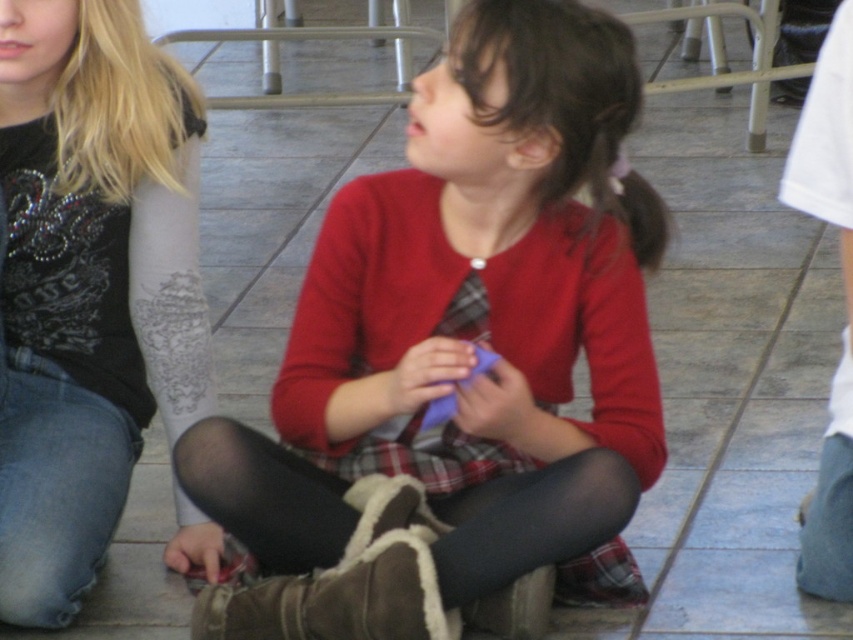
Identify the location of matte red sweater at center. (471, 326).

Is the position of matte red sweater at center less distant than that of matte black shirt at left?

Yes, it is.

At what (x,y) coordinates should I click in order to perform the action: click on matte red sweater at center. Please return your answer as a coordinate pair (x, y). Looking at the image, I should click on (471, 326).